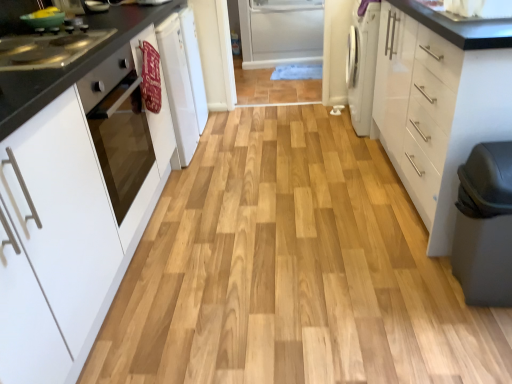
Question: Is white matte cabinet at left, which appears as the second cabinetry when viewed from the right, bigger or smaller than black glossy countertop at left?

Choices:
 (A) big
 (B) small

Answer: (A)

Question: From a real-world perspective, is white matte cabinet at left, which appears as the second cabinetry when viewed from the right, positioned above or below black glossy countertop at left?

Choices:
 (A) above
 (B) below

Answer: (A)

Question: Which is farther from the stainless steel stove at left?

Choices:
 (A) white glossy sink at upper right
 (B) white matte cabinet at left, which appears as the second cabinetry when viewed from the right
 (C) black glossy countertop at left
 (D) matte gray step stool at lower right
 (E) white glossy oven at left

Answer: (D)

Question: Estimate the real-world distances between objects in this image. Which object is farther from the white glossy sink at upper right?

Choices:
 (A) white glossy cabinet at right, positioned as the second cabinetry in left-to-right order
 (B) black glossy countertop at left
 (C) matte gray step stool at lower right
 (D) white glossy oven at left
 (E) stainless steel stove at left

Answer: (E)